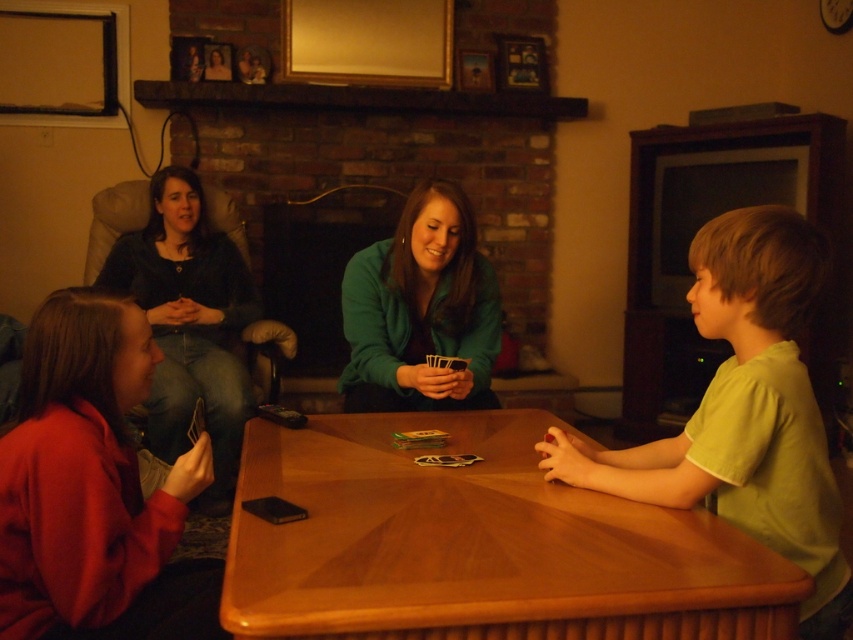
Consider the image. You are standing in the living room and want to place a small decorative item on one of the two points mentioned. The first point is at coordinates point (621, 452) and the second is at point (166, 365). Which point is closer to you?

Point (621, 452) is in front of point (166, 365), so it is closer to you.

You are organizing a charity clothing drive and need to pack items into boxes. You have a small box that can only fit items smaller than the green cotton shirt at right. Can the matte red sweater at lower left fit into this box?

The matte red sweater at lower left is smaller than the green cotton shirt at right, so it can fit into the box designed for items smaller than the green cotton shirt at right.

You are sitting on a sofa in the living room and want to reach the wooden table at center and the shiny plastic cards at center to join the card game. Which object should you move towards first based on their positions?

You should move towards the wooden table at center first because it is positioned on the right side of the shiny plastic cards at center, meaning the wooden table is closer to your current position on the sofa.